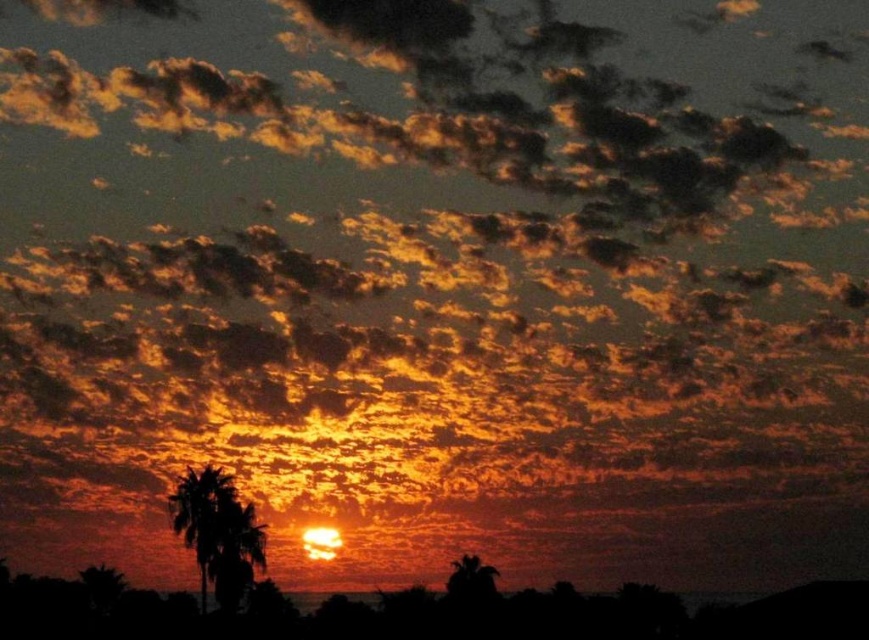
Is point (183, 538) farther from viewer compared to point (489, 593)?

No, it is not.

Is silhouette palm tree at left smaller than silhouette palm tree at lower right?

No, silhouette palm tree at left is not smaller than silhouette palm tree at lower right.

What do you see at coordinates (217, 532) in the screenshot? I see `silhouette palm tree at left` at bounding box center [217, 532].

The image size is (869, 640). Identify the location of silhouette palm tree at left. (217, 532).